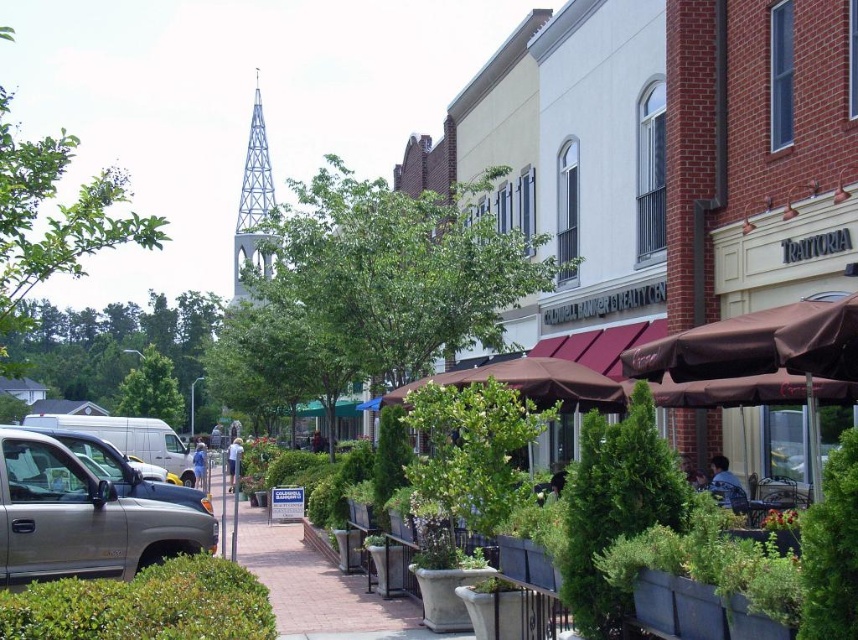
Question: Is the position of brown fabric umbrella at right less distant than that of brown fabric umbrella at center?

Choices:
 (A) yes
 (B) no

Answer: (A)

Question: Which point is closer to the camera?

Choices:
 (A) gold metallic truck at lower left
 (B) brown fabric umbrella at right
 (C) brown fabric umbrella at center

Answer: (B)

Question: Which point is farther to the camera?

Choices:
 (A) (716, 337)
 (B) (609, 400)

Answer: (B)

Question: From the image, what is the correct spatial relationship of gold metallic truck at lower left in relation to brown fabric umbrella at center?

Choices:
 (A) left
 (B) right

Answer: (A)

Question: Observing the image, what is the correct spatial positioning of gold metallic truck at lower left in reference to brown fabric umbrella at center?

Choices:
 (A) above
 (B) below

Answer: (B)

Question: Which object is farther from the camera taking this photo?

Choices:
 (A) brown fabric umbrella at right
 (B) brown fabric umbrella at center

Answer: (B)